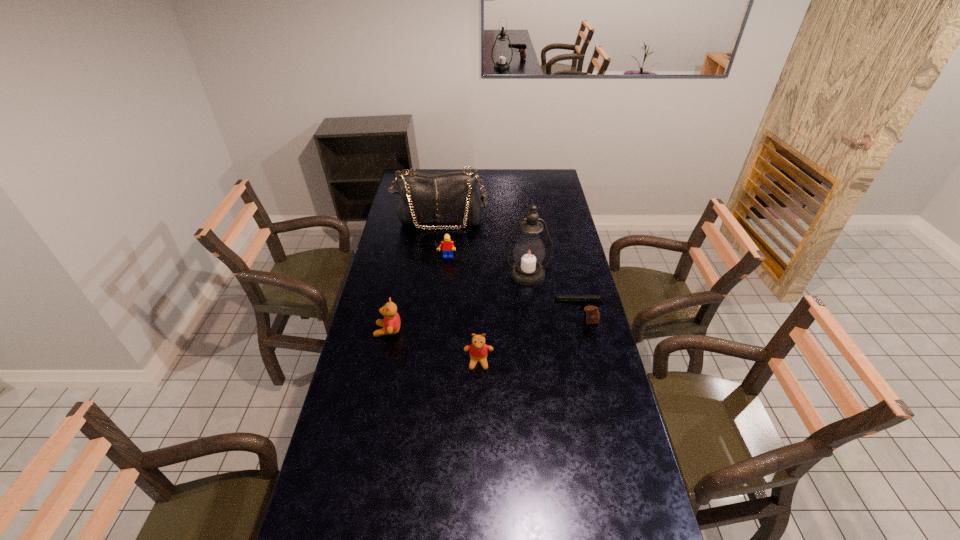
The image size is (960, 540). Identify the location of free spot that satisfies the following two spatial constraints: 1. at the front of the farthest object with chain and zipper; 2. on the right side of the tallest object. (434, 274).

Where is `free space that satisfies the following two spatial constraints: 1. at the barrel of the pistol; 2. on the front-facing side of the nearer teddy bear`? free space that satisfies the following two spatial constraints: 1. at the barrel of the pistol; 2. on the front-facing side of the nearer teddy bear is located at coordinates (584, 362).

I want to click on free space that satisfies the following two spatial constraints: 1. at the front of the second tallest object with chain and zipper; 2. on the left side of the tallest object, so click(434, 274).